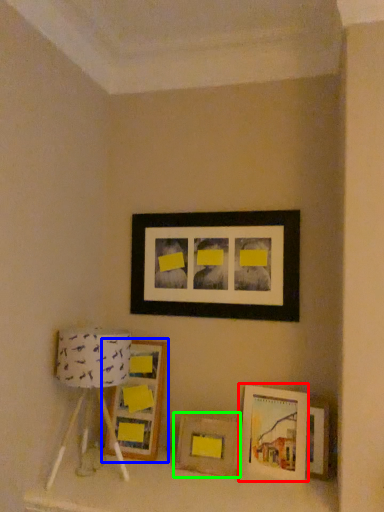
Question: Which object is positioned closest to picture frame (highlighted by a red box)? Select from picture frame (highlighted by a blue box) and picture frame (highlighted by a green box).

Choices:
 (A) picture frame
 (B) picture frame

Answer: (B)